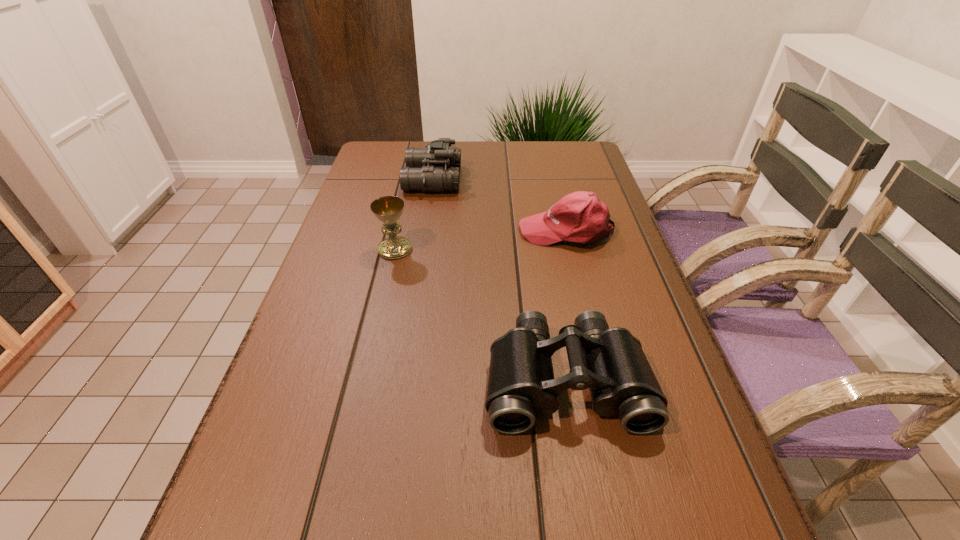
Where is `free area in between the chalice and the farther binoculars`? free area in between the chalice and the farther binoculars is located at coordinates (414, 214).

This screenshot has width=960, height=540. I want to click on free space between the farther binoculars and the nearer binoculars, so click(x=499, y=279).

Find the location of `vacant region between the nearer binoculars and the chalice`. vacant region between the nearer binoculars and the chalice is located at coordinates (480, 314).

You are a GUI agent. You are given a task and a screenshot of the screen. Output one action in this format:
    pyautogui.click(x=<x>, y=<y>)
    Task: Click on the object that stands as the third closest to the baseball cap
    Image resolution: width=960 pixels, height=540 pixels.
    Given the screenshot: What is the action you would take?
    pyautogui.click(x=388, y=209)

Select which object appears as the third closest to the chalice. Please provide its 2D coordinates. Your answer should be formatted as a tuple, i.e. [(x, y)], where the tuple contains the x and y coordinates of a point satisfying the conditions above.

[(610, 362)]

Where is `vacant point that satisfies the following two spatial constraints: 1. at the front of the baseball cap with the brim; 2. on the front-facing side of the nearest object`? vacant point that satisfies the following two spatial constraints: 1. at the front of the baseball cap with the brim; 2. on the front-facing side of the nearest object is located at coordinates (603, 380).

Find the location of `vacant area that satisfies the following two spatial constraints: 1. at the front of the baseball cap with the brim; 2. on the front-facing side of the nearest object`. vacant area that satisfies the following two spatial constraints: 1. at the front of the baseball cap with the brim; 2. on the front-facing side of the nearest object is located at coordinates (603, 380).

Find the location of a particular element. vacant space that satisfies the following two spatial constraints: 1. through the lenses of the left binoculars; 2. on the front side of the chalice is located at coordinates (421, 249).